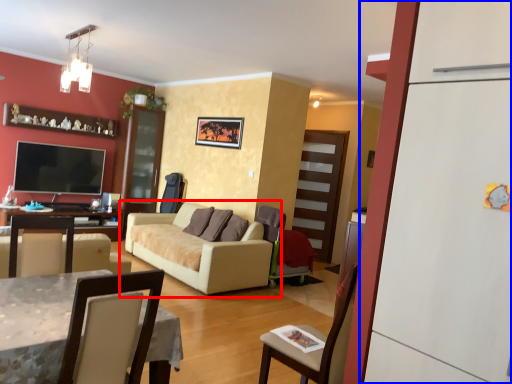
Question: Which object is further to the camera taking this photo, studio couch (highlighted by a red box) or fridge (highlighted by a blue box)?

Choices:
 (A) studio couch
 (B) fridge

Answer: (A)